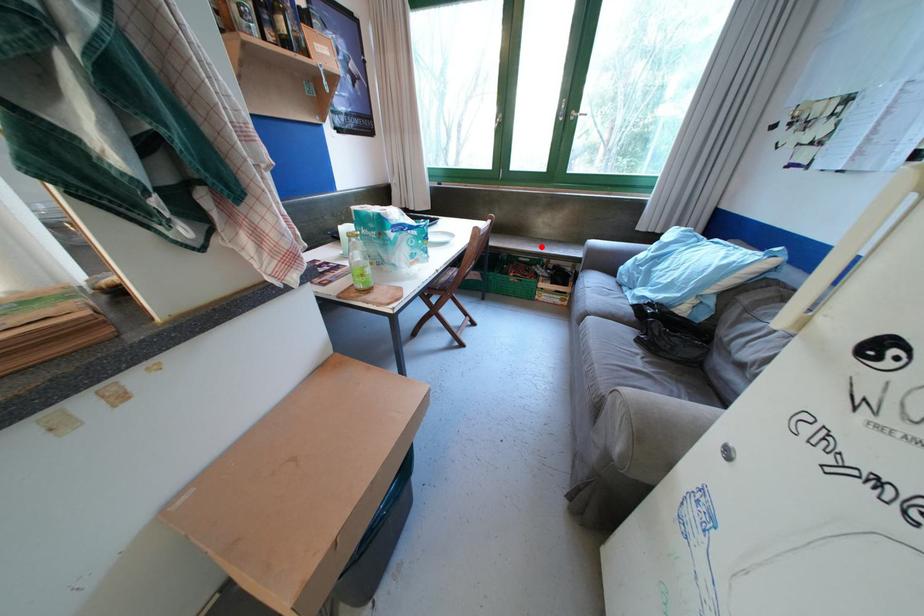
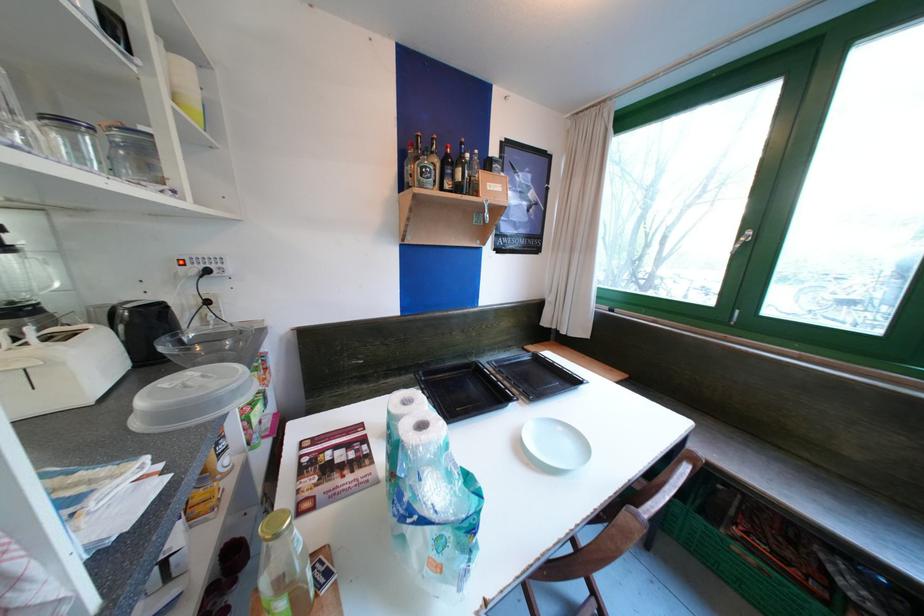
Locate, in the second image, the point that corresponds to the highlighted location in the first image.

(835, 503)